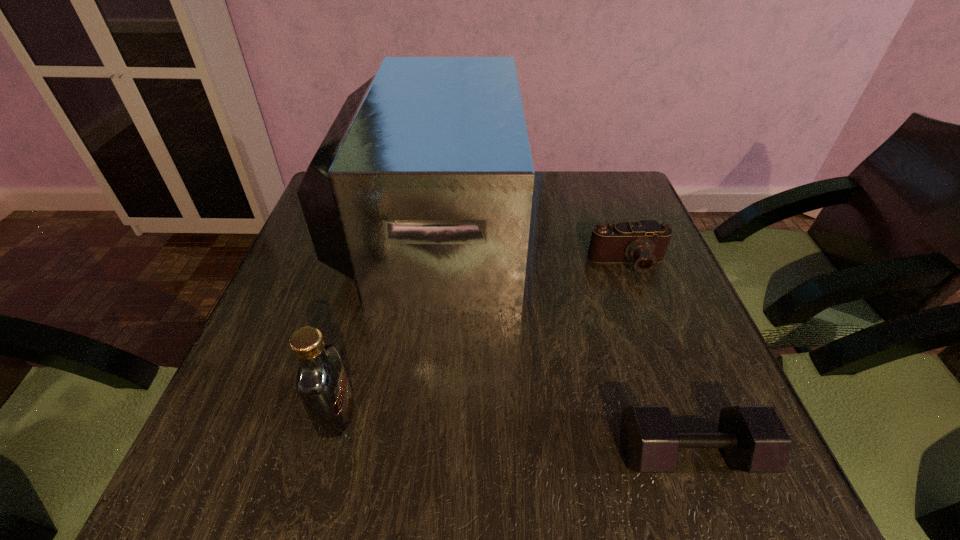
Locate an element on the screen. the closest object relative to the dumbbell is located at coordinates (421, 192).

Locate which object ranks in proximity to the dumbbell. Please provide its 2D coordinates. Your answer should be formatted as a tuple, i.e. [(x, y)], where the tuple contains the x and y coordinates of a point satisfying the conditions above.

[(421, 192)]

Identify the location of free spot that satisfies the following two spatial constraints: 1. on the front-facing side of the third shortest object; 2. on the right side of the dumbbell. (325, 454).

Image resolution: width=960 pixels, height=540 pixels. What are the coordinates of `vacant area in the image that satisfies the following two spatial constraints: 1. on the front-facing side of the vodka; 2. on the back side of the dumbbell` in the screenshot? It's located at (325, 454).

You are a GUI agent. You are given a task and a screenshot of the screen. Output one action in this format:
    pyautogui.click(x=<x>, y=<y>)
    Task: Click on the blank area in the image that satisfies the following two spatial constraints: 1. on the front-facing side of the dumbbell; 2. on the right side of the tallest object
    This screenshot has height=540, width=960.
    Given the screenshot: What is the action you would take?
    pyautogui.click(x=401, y=454)

Image resolution: width=960 pixels, height=540 pixels. What are the coordinates of `free space that satisfies the following two spatial constraints: 1. on the back side of the dumbbell; 2. on the front-facing side of the vodka` in the screenshot? It's located at (676, 414).

This screenshot has width=960, height=540. In order to click on free space that satisfies the following two spatial constraints: 1. on the front-facing side of the dumbbell; 2. on the left side of the vodka in this screenshot , I will do `click(325, 454)`.

Where is `vacant position in the image that satisfies the following two spatial constraints: 1. on the back side of the dumbbell; 2. on the front-facing side of the vodka`? This screenshot has width=960, height=540. vacant position in the image that satisfies the following two spatial constraints: 1. on the back side of the dumbbell; 2. on the front-facing side of the vodka is located at coordinates (676, 414).

Identify the location of vacant point that satisfies the following two spatial constraints: 1. on the front-facing side of the dumbbell; 2. on the right side of the tallest object. click(401, 454).

At what (x,y) coordinates should I click in order to perform the action: click on blank area in the image that satisfies the following two spatial constraints: 1. on the front-facing side of the dumbbell; 2. on the right side of the vodka. Please return your answer as a coordinate pair (x, y). Looking at the image, I should click on (325, 454).